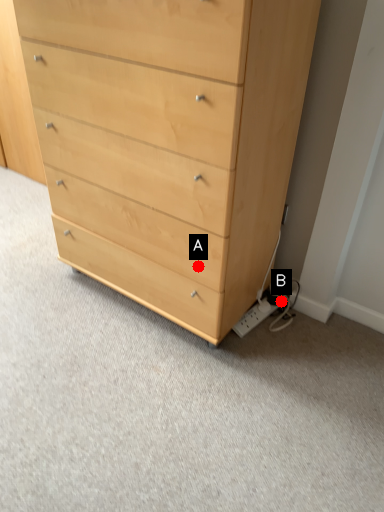
Question: Two points are circled on the image, labeled by A and B beside each circle. Which point is closer to the camera taking this photo?

Choices:
 (A) A is closer
 (B) B is closer

Answer: (A)